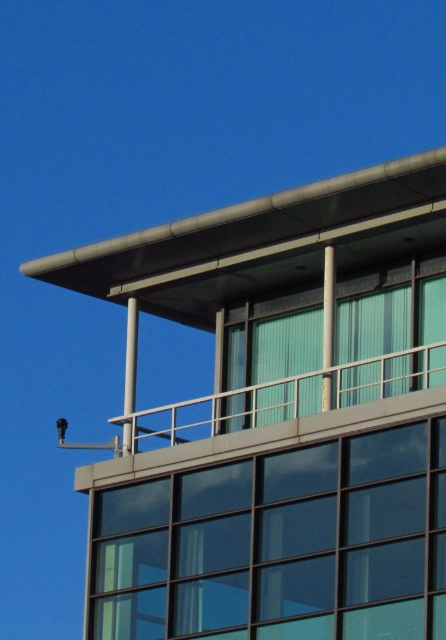
You are an architect designing a new building and want to ensure that the transparent glass window at center is wider than the green glass window at upper center. Based on the image provided, is this requirement met?

The transparent glass window at center might be wider than green glass window at upper center according to the description.

You are standing in front of the building and want to compare the positions of the transparent glass window at center and the green glass window at upper center. Which one is nearer to you?

The transparent glass window at center is closer to the viewer than the green glass window at upper center, so it is nearer to you.